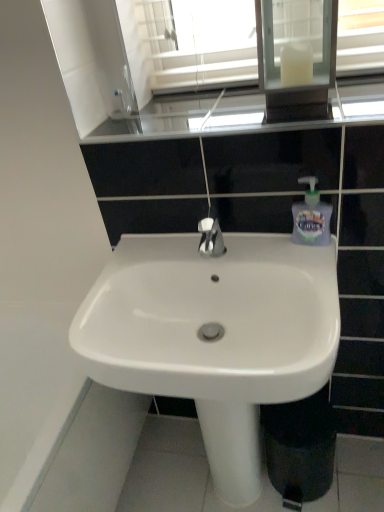
Measure the distance between glossy glass window sill at upper center and camera.

A distance of 84.40 centimeters exists between glossy glass window sill at upper center and camera.

In order to face translucent plastic soap dispenser at right, should I rotate leftwards or rightwards?

You should look right and rotate roughly 15.922 degrees.

Locate an element on the screen. This screenshot has height=512, width=384. glossy glass window sill at upper center is located at coordinates (234, 116).

Is white glossy sink at center at the back of glossy glass window sill at upper center?

glossy glass window sill at upper center does not have its back to white glossy sink at center.

Considering the relative sizes of glossy glass window sill at upper center and white glossy sink at center in the image provided, is glossy glass window sill at upper center taller than white glossy sink at center?

In fact, glossy glass window sill at upper center may be shorter than white glossy sink at center.

Are glossy glass window sill at upper center and white glossy sink at center far apart?

That's not correct — glossy glass window sill at upper center is a little close to white glossy sink at center.

Considering the relative sizes of glossy glass window sill at upper center and white glossy sink at center in the image provided, is glossy glass window sill at upper center smaller than white glossy sink at center?

Yes, glossy glass window sill at upper center is smaller than white glossy sink at center.

From the image's perspective, is translucent plastic soap dispenser at right located above white glass medicine cabinet at upper center?

No, from the image's perspective, translucent plastic soap dispenser at right is not on top of white glass medicine cabinet at upper center.

How distant is translucent plastic soap dispenser at right from white glass medicine cabinet at upper center?

The distance of translucent plastic soap dispenser at right from white glass medicine cabinet at upper center is 11.56 inches.

Would you consider translucent plastic soap dispenser at right to be distant from white glass medicine cabinet at upper center?

translucent plastic soap dispenser at right is actually quite close to white glass medicine cabinet at upper center.

Is translucent plastic soap dispenser at right inside the boundaries of white glass medicine cabinet at upper center, or outside?

translucent plastic soap dispenser at right cannot be found inside white glass medicine cabinet at upper center.

Is white glass medicine cabinet at upper center wider than white glossy sink at center?

No, white glass medicine cabinet at upper center is not wider than white glossy sink at center.

Does point (310, 10) appear closer or farther from the camera than point (153, 266)?

Point (310, 10) is farther from the camera than point (153, 266).

Is the position of white glass medicine cabinet at upper center less distant than that of white glossy sink at center?

No.

Can you confirm if white glass medicine cabinet at upper center is shorter than white glossy sink at center?

No, white glass medicine cabinet at upper center is not shorter than white glossy sink at center.

Between glossy glass window sill at upper center and translucent plastic soap dispenser at right, which one is positioned behind?

translucent plastic soap dispenser at right is behind.

Looking at their sizes, would you say glossy glass window sill at upper center is wider or thinner than translucent plastic soap dispenser at right?

In the image, glossy glass window sill at upper center appears to be wider than translucent plastic soap dispenser at right.

Based on the photo, between glossy glass window sill at upper center and white glass medicine cabinet at upper center, which one appears on the right side from the viewer's perspective?

white glass medicine cabinet at upper center.

In the scene shown: From the image's perspective, is glossy glass window sill at upper center located above or below white glass medicine cabinet at upper center?

glossy glass window sill at upper center is below white glass medicine cabinet at upper center.

Is glossy glass window sill at upper center facing towards white glass medicine cabinet at upper center?

No, glossy glass window sill at upper center is not oriented towards white glass medicine cabinet at upper center.

Considering the sizes of objects glossy glass window sill at upper center and white glass medicine cabinet at upper center in the image provided, who is bigger, glossy glass window sill at upper center or white glass medicine cabinet at upper center?

white glass medicine cabinet at upper center is bigger.

Can you confirm if white glass medicine cabinet at upper center is taller than glossy glass window sill at upper center?

Indeed, white glass medicine cabinet at upper center has a greater height compared to glossy glass window sill at upper center.

Consider the image. How distant is white glass medicine cabinet at upper center from glossy glass window sill at upper center?

5.03 inches.

From a real-world perspective, relative to glossy glass window sill at upper center, is white glass medicine cabinet at upper center vertically above or below?

white glass medicine cabinet at upper center is situated higher than glossy glass window sill at upper center in the real world.

Find the location of a particular element. This screenshot has width=384, height=512. window sill on the left of white glass medicine cabinet at upper center is located at coordinates (234, 116).

Would you say white glass medicine cabinet at upper center is part of white glossy sink at center's contents?

That's incorrect, white glass medicine cabinet at upper center is not inside white glossy sink at center.

How much distance is there between white glossy sink at center and white glass medicine cabinet at upper center?

The distance of white glossy sink at center from white glass medicine cabinet at upper center is 20.19 inches.

Who is more distant, white glossy sink at center or white glass medicine cabinet at upper center?

white glass medicine cabinet at upper center is behind.

Could you tell me if white glossy sink at center is turned towards white glass medicine cabinet at upper center?

No.

Find the location of `sink on the left of glossy glass window sill at upper center`. sink on the left of glossy glass window sill at upper center is located at coordinates (215, 335).

Find the location of a particular element. The width and height of the screenshot is (384, 512). soap dispenser below the white glass medicine cabinet at upper center (from the image's perspective) is located at coordinates (311, 217).

Based on their spatial positions, is translucent plastic soap dispenser at right or white glass medicine cabinet at upper center further from white glossy sink at center?

white glass medicine cabinet at upper center is further to white glossy sink at center.

Looking at the image, which one is located further to glossy glass window sill at upper center, translucent plastic soap dispenser at right or white glossy sink at center?

The object further to glossy glass window sill at upper center is white glossy sink at center.

Estimate the real-world distances between objects in this image. Which object is closer to white glossy sink at center, glossy glass window sill at upper center or white glass medicine cabinet at upper center?

glossy glass window sill at upper center lies closer to white glossy sink at center than the other object.

When comparing their distances from white glass medicine cabinet at upper center, does white glossy sink at center or glossy glass window sill at upper center seem further?

white glossy sink at center is positioned further to the anchor white glass medicine cabinet at upper center.

Looking at this image, looking at the image, which one is located further to white glass medicine cabinet at upper center, translucent plastic soap dispenser at right or white glossy sink at center?

Among the two, white glossy sink at center is located further to white glass medicine cabinet at upper center.

Considering their positions, is white glass medicine cabinet at upper center positioned closer to translucent plastic soap dispenser at right than glossy glass window sill at upper center?

Based on the image, glossy glass window sill at upper center appears to be nearer to translucent plastic soap dispenser at right.

Looking at the image, which one is located further to glossy glass window sill at upper center, white glass medicine cabinet at upper center or white glossy sink at center?

white glossy sink at center.

Based on their spatial positions, is glossy glass window sill at upper center or white glass medicine cabinet at upper center closer to translucent plastic soap dispenser at right?

glossy glass window sill at upper center.

I want to click on window sill between white glass medicine cabinet at upper center and white glossy sink at center vertically, so click(234, 116).

This screenshot has width=384, height=512. What are the coordinates of `window sill between white glass medicine cabinet at upper center and translucent plastic soap dispenser at right in the vertical direction` in the screenshot? It's located at (234, 116).

Locate an element on the screen. The image size is (384, 512). soap dispenser between glossy glass window sill at upper center and white glossy sink at center in the up-down direction is located at coordinates click(311, 217).

Locate an element on the screen. The height and width of the screenshot is (512, 384). soap dispenser between white glass medicine cabinet at upper center and white glossy sink at center vertically is located at coordinates (311, 217).